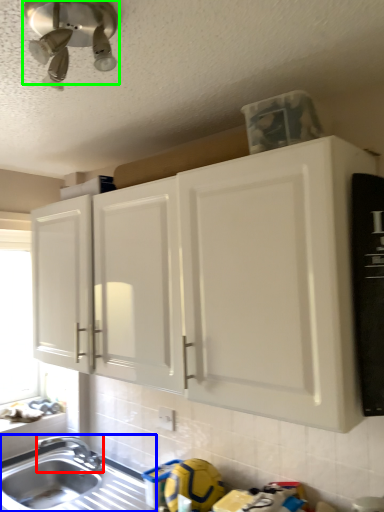
Question: Based on their relative distances, which object is farther from tap (highlighted by a red box)? Choose from sink (highlighted by a blue box) and light fixture (highlighted by a green box).

Choices:
 (A) sink
 (B) light fixture

Answer: (B)